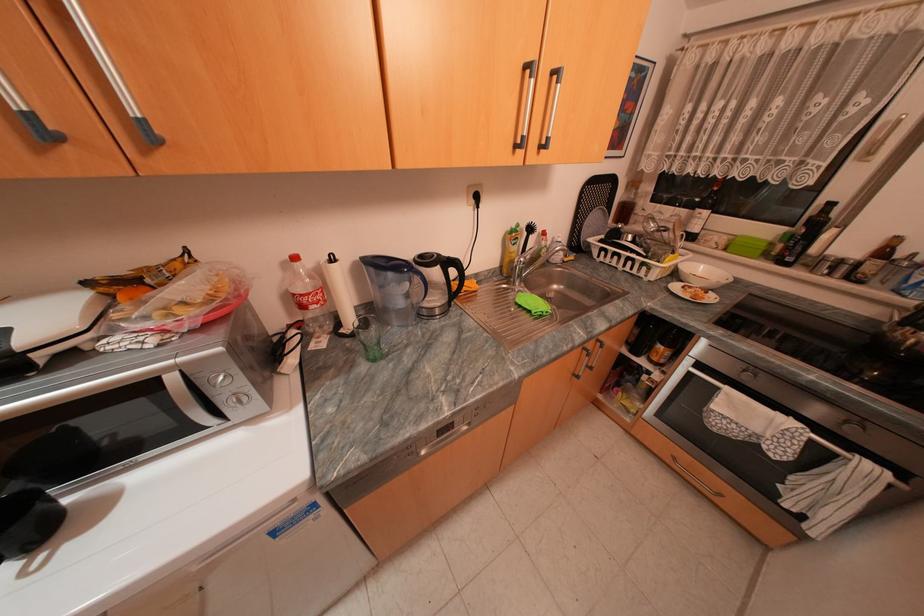
Find where to turn the oven control knob. Please return your answer as a coordinate pair (x, y).

(237, 399)